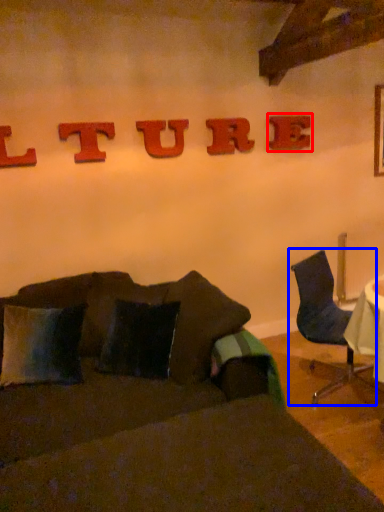
Question: Which of the following is the closest to the observer, alphabet (highlighted by a red box) or chair (highlighted by a blue box)?

Choices:
 (A) alphabet
 (B) chair

Answer: (B)